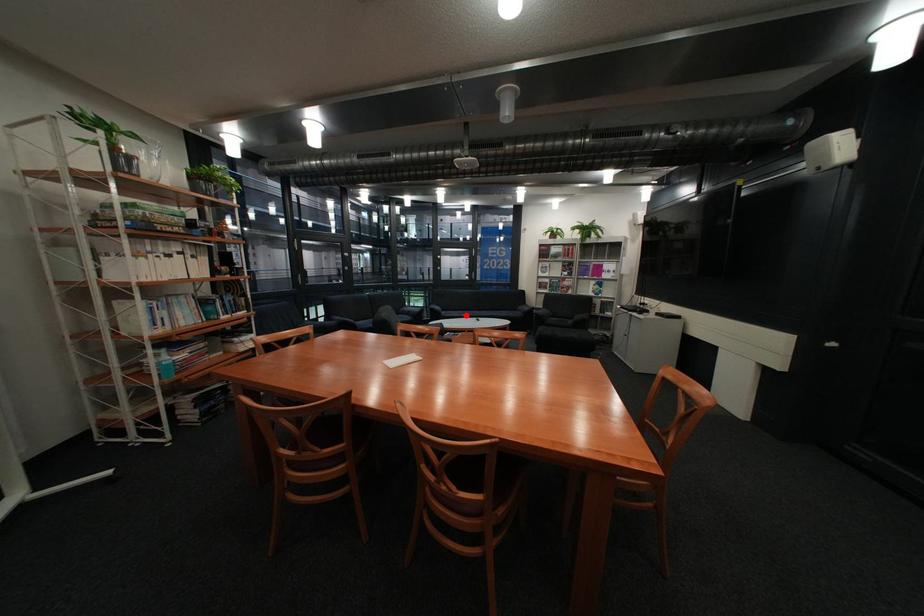
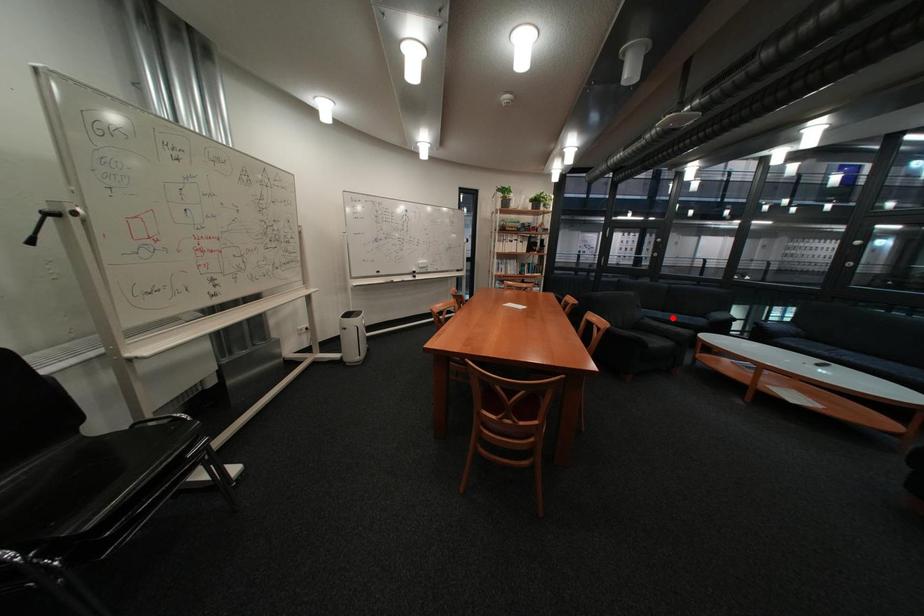
I am providing you with two images of the same scene from different viewpoints. A red point is marked on the first image and another point is marked on the second image. Are the points marked in image1 and image2 representing the same 3D position?

No